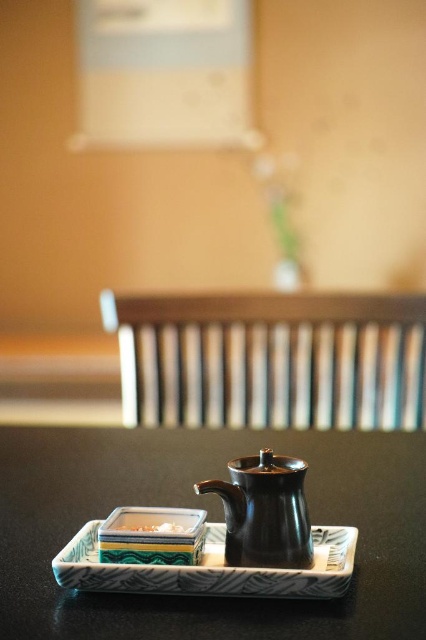
Question: Which of the following is the closest to the observer?

Choices:
 (A) white glossy rectangular plate at center
 (B) patterned ceramic tray at center
 (C) matte black tray at center
 (D) black ceramic teapot at center

Answer: (C)

Question: Which of the following is the closest to the observer?

Choices:
 (A) (172, 524)
 (B) (222, 586)
 (C) (37, 564)
 (D) (224, 506)

Answer: (B)

Question: Is matte black tray at center wider than patterned ceramic tray at center?

Choices:
 (A) yes
 (B) no

Answer: (A)

Question: Does matte black tray at center have a lesser width compared to black ceramic teapot at center?

Choices:
 (A) no
 (B) yes

Answer: (A)

Question: Considering the relative positions of patterned ceramic tray at center and black ceramic teapot at center in the image provided, where is patterned ceramic tray at center located with respect to black ceramic teapot at center?

Choices:
 (A) below
 (B) above

Answer: (A)

Question: Estimate the real-world distances between objects in this image. Which object is farther from the white glossy rectangular plate at center?

Choices:
 (A) black ceramic teapot at center
 (B) patterned ceramic tray at center

Answer: (A)